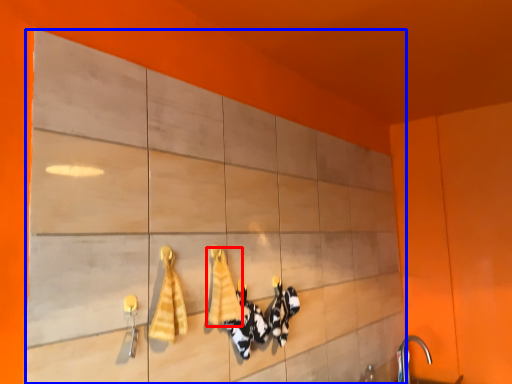
Question: Which object appears farthest to the camera in this image, bath towel (highlighted by a red box) or cabinetry (highlighted by a blue box)?

Choices:
 (A) bath towel
 (B) cabinetry

Answer: (A)